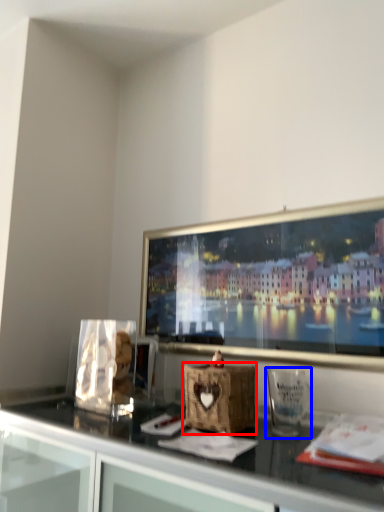
Question: Which point is further to the camera, basket (highlighted by a red box) or glass vase (highlighted by a blue box)?

Choices:
 (A) basket
 (B) glass vase

Answer: (A)